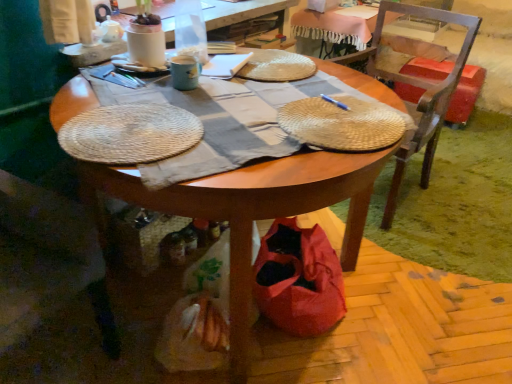
Where is `free space in front of blue metallic pen at center`? This screenshot has height=384, width=512. free space in front of blue metallic pen at center is located at coordinates (345, 121).